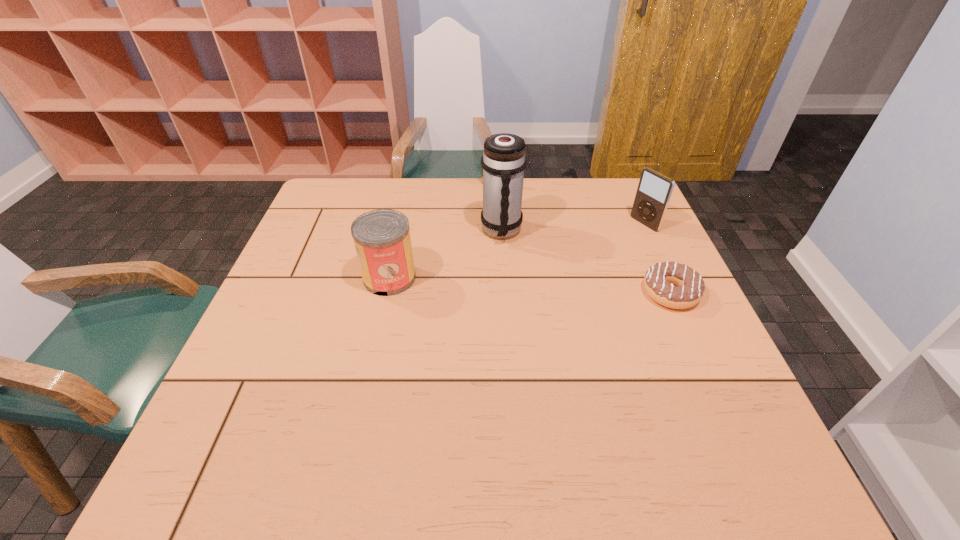
You are a GUI agent. You are given a task and a screenshot of the screen. Output one action in this format:
    pyautogui.click(x=<x>, y=<y>)
    Task: Click on the doughnut that is positioned at the right edge
    This screenshot has height=540, width=960.
    Given the screenshot: What is the action you would take?
    pyautogui.click(x=690, y=288)

Locate an element on the screen. iPod that is at the right edge is located at coordinates (654, 191).

This screenshot has height=540, width=960. Identify the location of object at the far right corner. (654, 191).

At what (x,y) coordinates should I click in order to perform the action: click on free point at the far edge. Please return your answer as a coordinate pair (x, y). This screenshot has height=540, width=960. Looking at the image, I should click on (432, 203).

Image resolution: width=960 pixels, height=540 pixels. In the image, there is a desktop. What are the coordinates of `vacant space at the left edge` in the screenshot? It's located at click(281, 292).

Locate an element on the screen. vacant space at the right edge is located at coordinates (621, 227).

In the image, there is a desktop. Where is `blank space at the near left corner`? The height and width of the screenshot is (540, 960). blank space at the near left corner is located at coordinates (251, 393).

Identify the location of vacant space at the near right corner of the desktop. The width and height of the screenshot is (960, 540). (749, 411).

In order to click on vacant area that lies between the tallest object and the leftmost object in this screenshot , I will do `click(445, 254)`.

This screenshot has height=540, width=960. What are the coordinates of `vacant region between the iPod and the tallest object` in the screenshot? It's located at (573, 227).